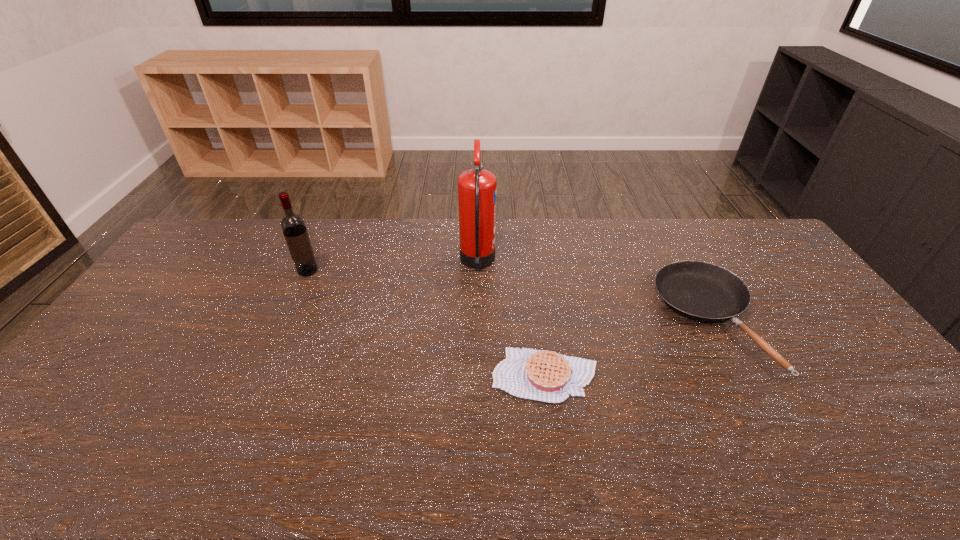
Locate an element on the screen. The width and height of the screenshot is (960, 540). free space at the far edge of the desktop is located at coordinates (324, 247).

This screenshot has height=540, width=960. In the image, there is a desktop. What are the coordinates of `free space at the left edge` in the screenshot? It's located at point(172,294).

You are a GUI agent. You are given a task and a screenshot of the screen. Output one action in this format:
    pyautogui.click(x=<x>, y=<y>)
    Task: Click on the vacant area at the right edge
    This screenshot has width=960, height=540.
    Given the screenshot: What is the action you would take?
    pyautogui.click(x=812, y=353)

Where is `vacant space at the far left corner of the desktop`? Image resolution: width=960 pixels, height=540 pixels. vacant space at the far left corner of the desktop is located at coordinates (232, 226).

The width and height of the screenshot is (960, 540). What are the coordinates of `vacant space at the far right corner of the desktop` in the screenshot? It's located at coord(770,245).

Locate an element on the screen. empty space between the fire extinguisher and the third shortest object is located at coordinates (393, 267).

At what (x,y) coordinates should I click in order to perform the action: click on vacant region between the wine bottle and the pie. Please return your answer as a coordinate pair (x, y). The width and height of the screenshot is (960, 540). Looking at the image, I should click on (426, 323).

You are a GUI agent. You are given a task and a screenshot of the screen. Output one action in this format:
    pyautogui.click(x=<x>, y=<y>)
    Task: Click on the free spot between the tallest object and the leftmost object
    This screenshot has width=960, height=540.
    Given the screenshot: What is the action you would take?
    pyautogui.click(x=393, y=267)

I want to click on free space between the pie and the wine bottle, so click(426, 323).

Identify the location of free point between the tallest object and the rightmost object. Image resolution: width=960 pixels, height=540 pixels. (593, 291).